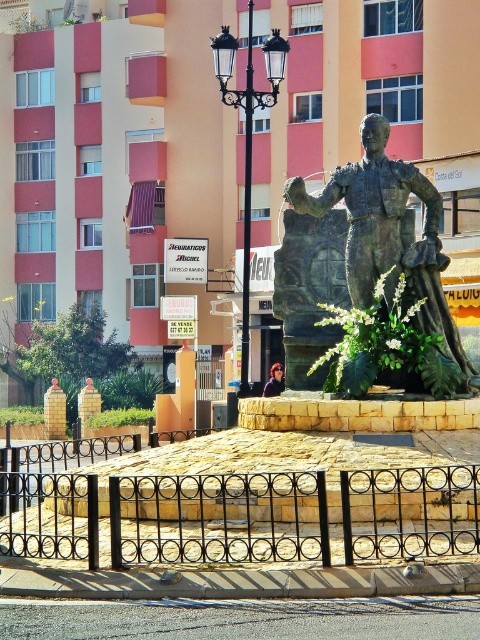
Is black metal streetlight at center below shiny red hair at center?

Actually, black metal streetlight at center is above shiny red hair at center.

Which is more to the left, black metal streetlight at center or shiny red hair at center?

black metal streetlight at center is more to the left.

Between point (241, 356) and point (268, 396), which one is positioned behind?

The point (268, 396) is more distant.

The image size is (480, 640). I want to click on black metal streetlight at center, so click(248, 136).

Consider the image. Between beige concrete hotel at center and shiny red hair at center, which one has more height?

Standing taller between the two is beige concrete hotel at center.

Is point (283, 150) in front of point (275, 380)?

That is False.

Between point (301, 100) and point (271, 372), which one is positioned behind?

The point (301, 100) is more distant.

Find the location of a particular element. beige concrete hotel at center is located at coordinates (112, 154).

Which of these two, bronze statue at center or black metal streetlight at center, stands shorter?

bronze statue at center is shorter.

Consider the image. Is bronze statue at center wider than black metal streetlight at center?

Incorrect, bronze statue at center's width does not surpass black metal streetlight at center's.

Which is behind, point (416, 244) or point (242, 104)?

Positioned behind is point (242, 104).

The image size is (480, 640). Find the location of `bronze statue at center`. bronze statue at center is located at coordinates (370, 244).